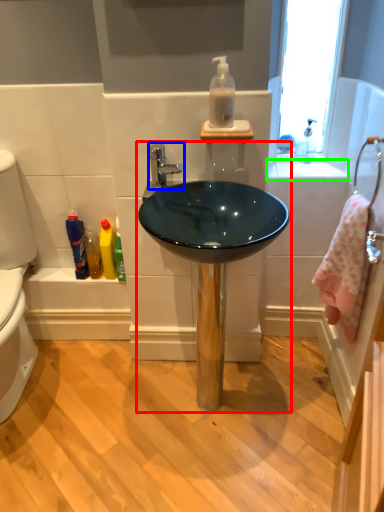
Question: Which object is the farthest from sink (highlighted by a red box)? Choose among these: tap (highlighted by a blue box) or counter top (highlighted by a green box).

Choices:
 (A) tap
 (B) counter top

Answer: (B)